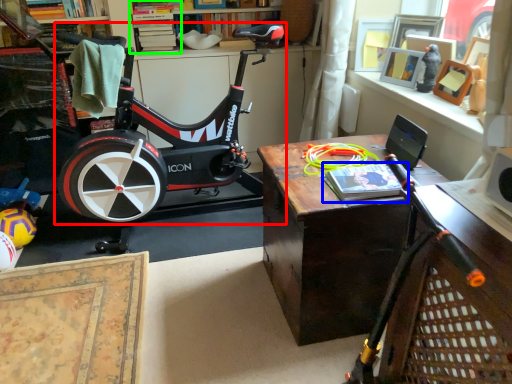
Question: Estimate the real-world distances between objects in this image. Which object is closer to stationary bicycle (highlighted by a red box), book (highlighted by a blue box) or shelf (highlighted by a green box)?

Choices:
 (A) book
 (B) shelf

Answer: (B)